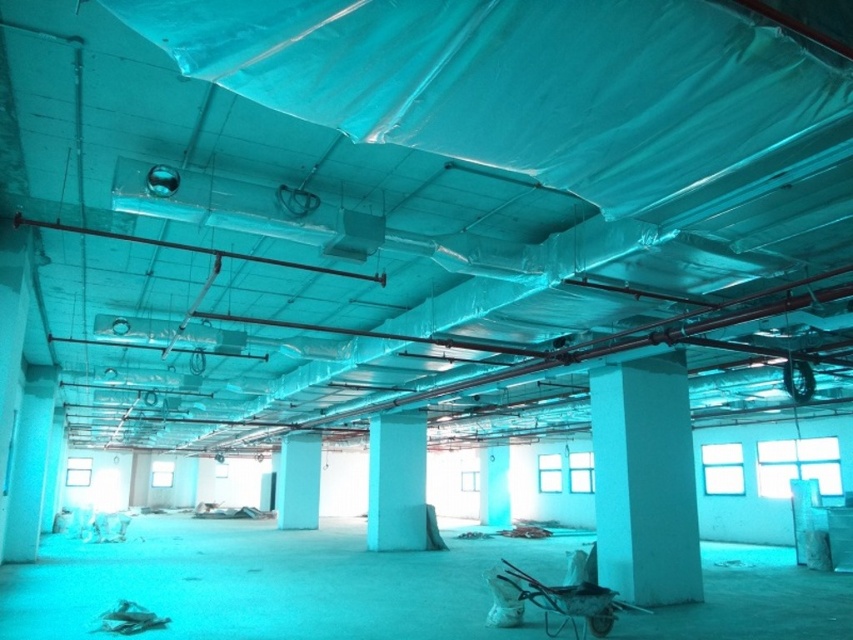
Question: Which of the following is the closest to the observer?

Choices:
 (A) smooth concrete pillar at center
 (B) metallic wire cart at lower right

Answer: (B)

Question: Is white smooth column at center behind metallic wire cart at lower right?

Choices:
 (A) yes
 (B) no

Answer: (A)

Question: In this image, where is white smooth column at center located relative to white smooth pillar at center?

Choices:
 (A) below
 (B) above

Answer: (B)

Question: Which object is the closest to the smooth concrete pillar at center?

Choices:
 (A) metallic wire cart at lower right
 (B) white smooth pillar at center
 (C) white smooth column at center

Answer: (B)

Question: Can you confirm if white smooth column at center is positioned to the right of smooth concrete pillar at center?

Choices:
 (A) no
 (B) yes

Answer: (B)

Question: Which is nearer to the white smooth pillar at center?

Choices:
 (A) metallic wire cart at lower right
 (B) smooth concrete pillar at center
 (C) white smooth column at center

Answer: (B)